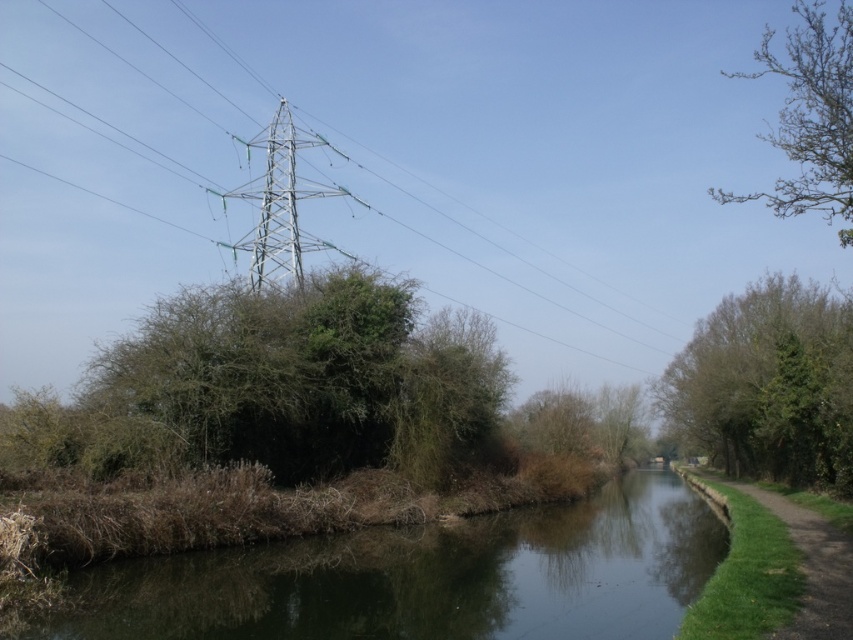
Between point (148, 12) and point (798, 588), which one is positioned behind?

Positioned behind is point (148, 12).

Does metallic silver power line at upper center have a lesser width compared to green grassy path at lower right?

Incorrect, metallic silver power line at upper center's width is not less than green grassy path at lower right's.

Is point (198, 102) farther from viewer compared to point (764, 593)?

Yes, point (198, 102) is behind point (764, 593).

I want to click on metallic silver power line at upper center, so click(383, 164).

Can you confirm if green leafy tree at right is positioned above bare branches at upper right?

Incorrect, green leafy tree at right is not positioned above bare branches at upper right.

Which of these two, green leafy tree at right or bare branches at upper right, stands shorter?

With less height is green leafy tree at right.

Between point (706, 422) and point (819, 45), which one is positioned in front?

Positioned in front is point (819, 45).

The width and height of the screenshot is (853, 640). In order to click on green leafy tree at right in this screenshot , I will do `click(769, 385)`.

Who is positioned more to the right, green grassy river at center or metallic silver tower at center?

green grassy river at center

Is green grassy river at center smaller than metallic silver tower at center?

Indeed, green grassy river at center has a smaller size compared to metallic silver tower at center.

What are the coordinates of `green grassy river at center` in the screenshot? It's located at (425, 577).